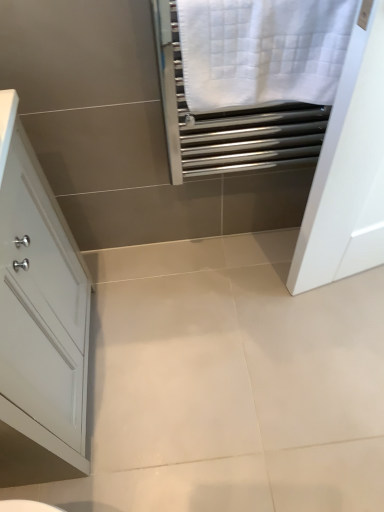
Where is `free point below white textured towel at upper right (from a real-world perspective)`? free point below white textured towel at upper right (from a real-world perspective) is located at coordinates pyautogui.click(x=251, y=253).